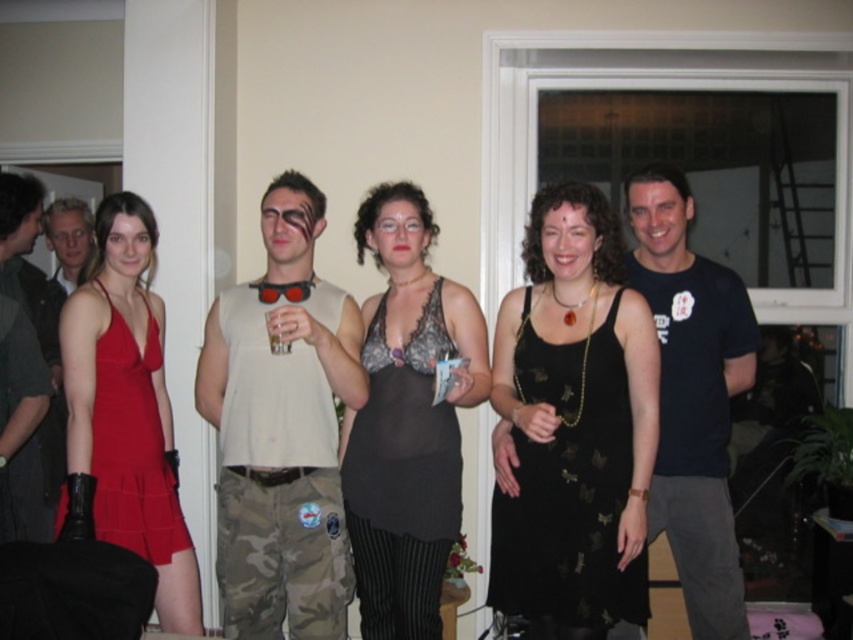
What do you see at coordinates (569, 488) in the screenshot? I see `black satin dress at center` at bounding box center [569, 488].

Can you confirm if black satin dress at center is shorter than matte black dress at left?

Indeed, black satin dress at center has a lesser height compared to matte black dress at left.

Find the location of a particular element. Image resolution: width=853 pixels, height=640 pixels. black satin dress at center is located at coordinates (569, 488).

You are a GUI agent. You are given a task and a screenshot of the screen. Output one action in this format:
    pyautogui.click(x=<x>, y=<y>)
    Task: Click on the black satin dress at center
    The height and width of the screenshot is (640, 853).
    Given the screenshot: What is the action you would take?
    pyautogui.click(x=569, y=488)

Between matte black dress at left and translucent plastic cup at center, which one has more height?

matte black dress at left

Between matte black dress at left and translucent plastic cup at center, which one appears on the left side from the viewer's perspective?

From the viewer's perspective, matte black dress at left appears more on the left side.

Is point (74, 257) behind point (281, 342)?

Yes, point (74, 257) is farther from viewer.

Locate an element on the screen. matte black dress at left is located at coordinates (59, 314).

Who is taller, black satin dress at center or black lace dress at center?

With more height is black satin dress at center.

At what (x,y) coordinates should I click in order to perform the action: click on black satin dress at center. Please return your answer as a coordinate pair (x, y). The height and width of the screenshot is (640, 853). Looking at the image, I should click on (569, 488).

Find the location of a particular element. The width and height of the screenshot is (853, 640). black satin dress at center is located at coordinates (569, 488).